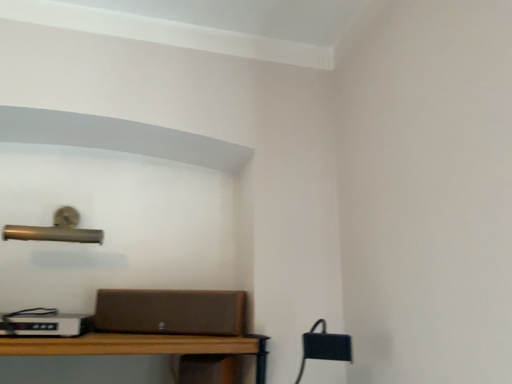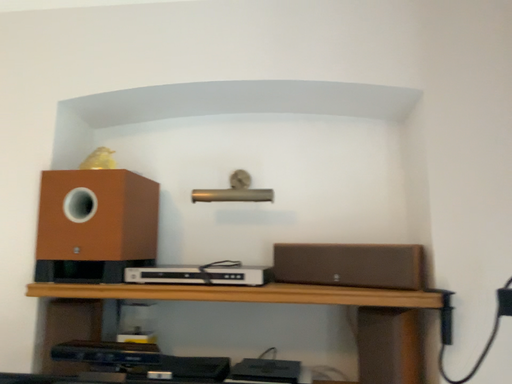
Question: Which way did the camera rotate in the video?

Choices:
 (A) rotated upward
 (B) rotated downward

Answer: (B)